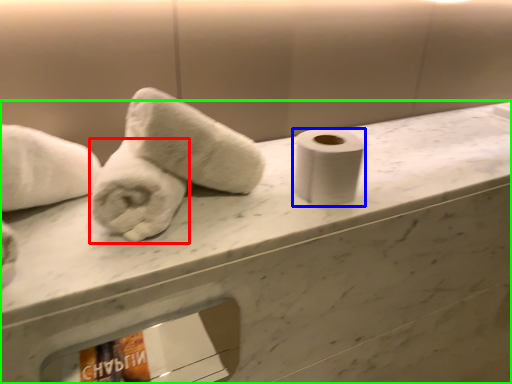
Question: Which is nearer to the towel (highlighted by a red box)? toilet paper (highlighted by a blue box) or counter (highlighted by a green box).

Choices:
 (A) toilet paper
 (B) counter

Answer: (A)